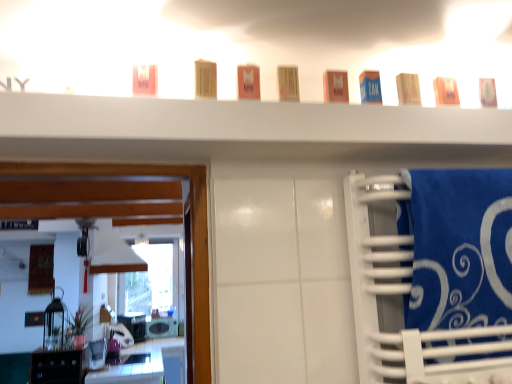
Question: From their relative heights in the image, would you say blue cardboard box at upper center, the third toiletry from the right, is taller or shorter than white glossy microwave at lower left, which appears as the second appliance when viewed from the top?

Choices:
 (A) short
 (B) tall

Answer: (A)

Question: Considering the positions of blue cardboard box at upper center, which is the sixth toiletry in left-to-right order, and white glossy microwave at lower left, the first appliance in the bottom-to-top sequence, in the image, is blue cardboard box at upper center, which is the sixth toiletry in left-to-right order, bigger or smaller than white glossy microwave at lower left, the first appliance in the bottom-to-top sequence,?

Choices:
 (A) small
 (B) big

Answer: (A)

Question: Estimate the real-world distances between objects in this image. Which object is closer to the glossy white vanity at lower left?

Choices:
 (A) metallic silver toaster at lower left, the second appliance from the bottom
 (B) matte beige soap at upper right, which ranks as the seventh toiletry in left-to-right order
 (C) blue cardboard box at upper center, which is the sixth toiletry in left-to-right order
 (D) blue soft towel at right
 (E) orange matte box at center, which is the 6th toiletry in right-to-left order

Answer: (A)

Question: Based on their relative distances, which object is nearer to the wooden block at center, placed as the second toiletry when sorted from left to right?

Choices:
 (A) matte plastic container at center, the 4th toiletry positioned from the left
 (B) matte pink soap at upper left, arranged as the 1th toiletry when viewed from the left
 (C) glossy white vanity at lower left
 (D) orange matte box at center, which is the 6th toiletry in right-to-left order
 (E) blue soft towel at right

Answer: (D)